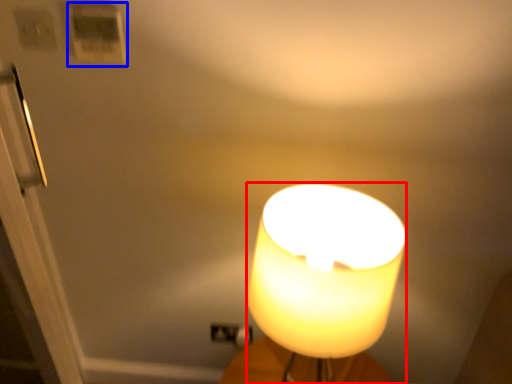
Question: Which point is closer to the camera, lamp (highlighted by a red box) or light switch (highlighted by a blue box)?

Choices:
 (A) lamp
 (B) light switch

Answer: (A)